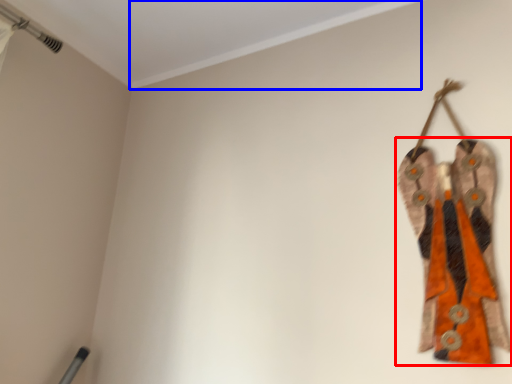
Question: Which object is closer to the camera taking this photo, fancy dress (highlighted by a red box) or trim (highlighted by a blue box)?

Choices:
 (A) fancy dress
 (B) trim

Answer: (B)